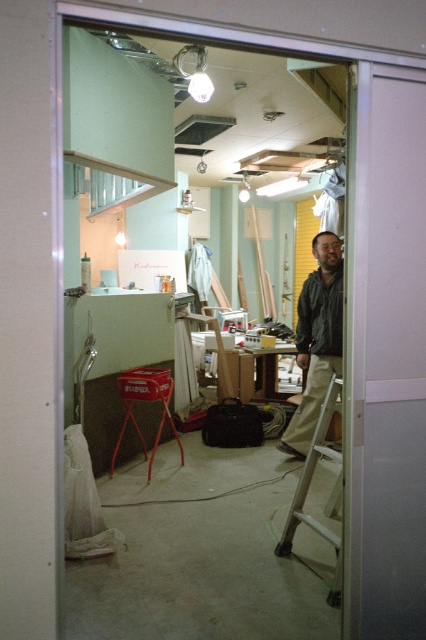
Question: Which point is farther from the camera taking this photo?

Choices:
 (A) (301, 502)
 (B) (334, 304)
 (C) (339, 445)

Answer: (C)

Question: Which object is positioned closest to the metallic silver ladder at center?

Choices:
 (A) transparent glass door at center
 (B) dark green jacket at center

Answer: (B)

Question: From the image, what is the correct spatial relationship of dark green jacket at center in relation to metallic silver ladder at center?

Choices:
 (A) left
 (B) right

Answer: (B)

Question: Can you confirm if transparent glass door at center is positioned to the left of dark green jacket at center?

Choices:
 (A) yes
 (B) no

Answer: (A)

Question: Does dark green jacket at center have a greater width compared to metallic silver ladder at center?

Choices:
 (A) no
 (B) yes

Answer: (B)

Question: Which of the following is the farthest from the observer?

Choices:
 (A) metallic silver ladder at center
 (B) dark green jacket at center
 (C) transparent glass door at center

Answer: (C)